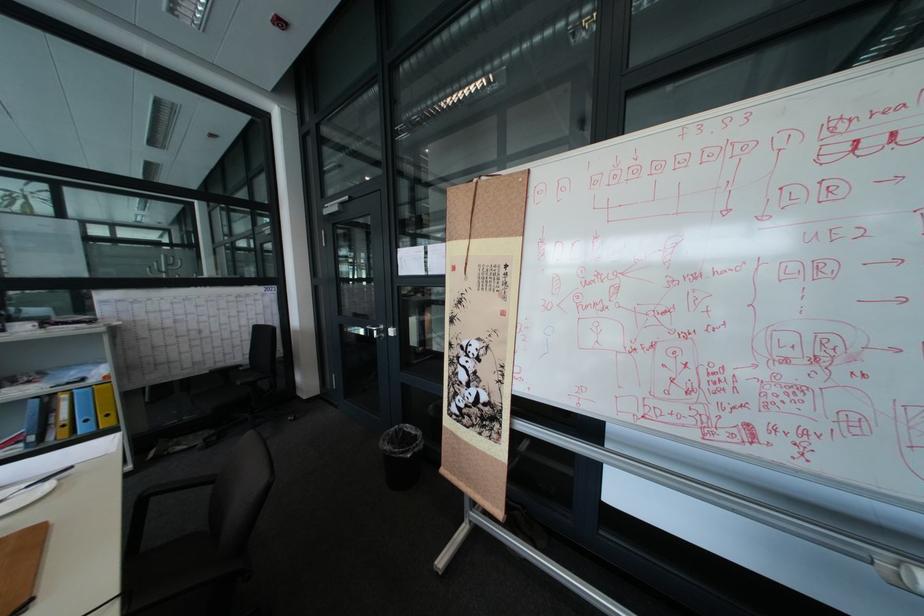
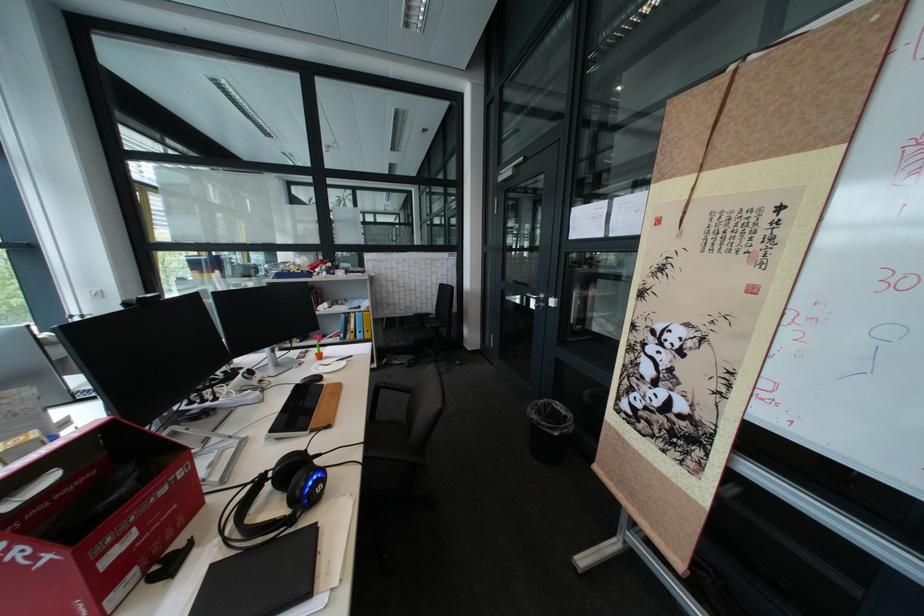
Where in the second image is the point corresponding to [226,482] from the first image?

(423, 392)